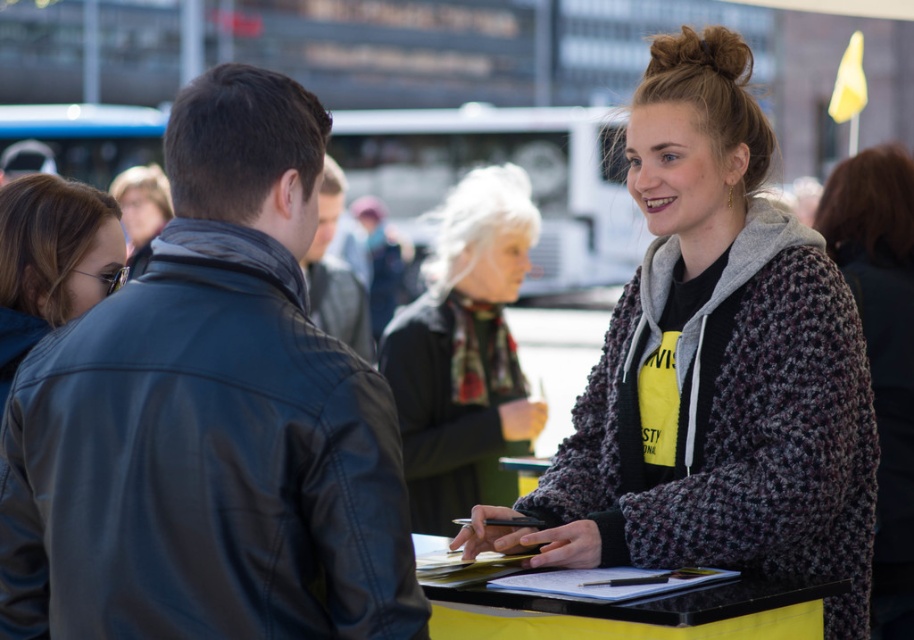
You are at a busy event and need to quickly grab your leather jacket at left and fluffy gray sweater at center. Which one is closer to the left side of the scene?

The leather jacket at left is closer to the left side of the scene as it is positioned to the left of the fluffy gray sweater at center.

You are a fashion designer observing the woman in the scene. You need to decide which item to place on the mannequin first, the knitted gray cardigan at center or the knitted gray sweater at center. Which one should you choose based on their sizes?

The knitted gray cardigan at center has a smaller size compared to knitted gray sweater at center. Therefore, you should place the knitted gray sweater at center first as it is larger and might need more space on the mannequin.

You are a photographer standing at the edge of the scene. You need to capture a photo that includes both the leather jacket at left and the fluffy gray sweater at center. Given that your camera can focus on objects within a 4 meter range, will you be able to include both in the same frame?

The distance between the leather jacket at left and the fluffy gray sweater at center is 3.68 meters. Since the camera can focus within a 4 meter range, both objects can be included in the same frame as the distance is within the camera range.